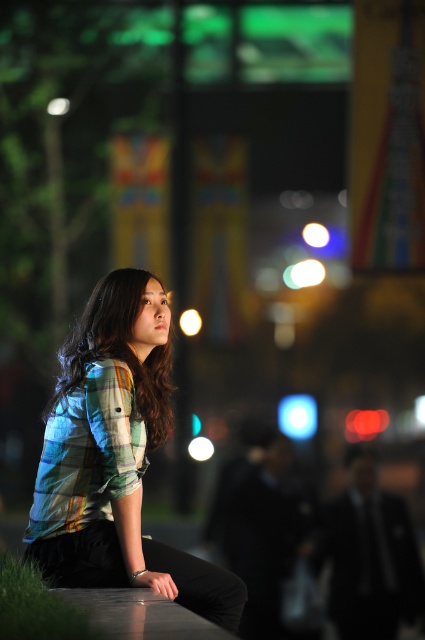
You are standing in a nighttime urban park and see two points in the scene. The first point is at coordinates point (85, 458) and the second is at point (158, 368). Which point is closer to you?

Point (85, 458) is closer to the viewer than point (158, 368).

You are a photographer adjusting your camera settings to capture the nighttime scene. You notice two objects labeled plaid fabric shirt at center and plaid shirt at center in your viewfinder. Which one is positioned to the right?

The plaid fabric shirt at center is positioned to the right of the plaid shirt at center according to the description.